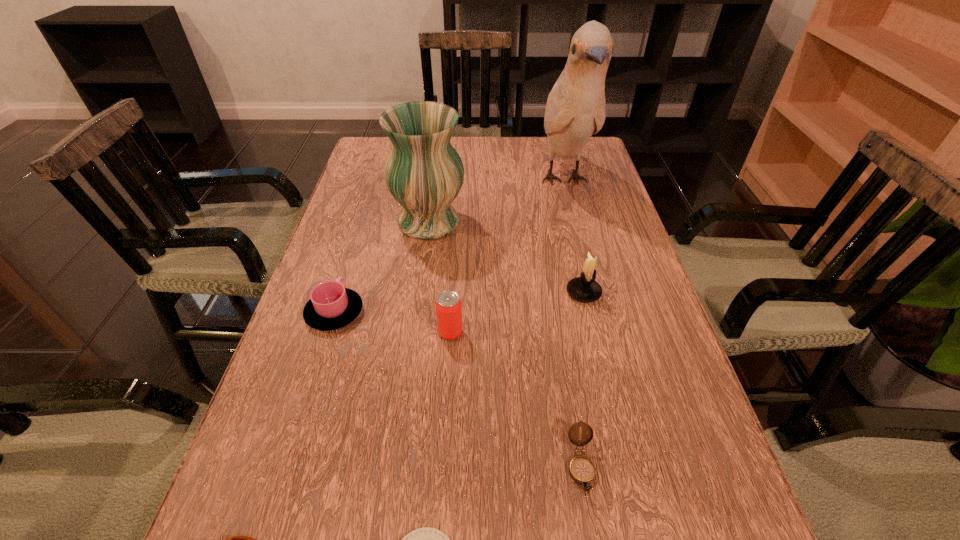
The image size is (960, 540). Identify the location of object that can be found as the third closest to the fourth tallest object. (424, 173).

Identify which compass is the closest to the cup. Please provide its 2D coordinates. Your answer should be formatted as a tuple, i.e. [(x, y)], where the tuple contains the x and y coordinates of a point satisfying the conditions above.

[(235, 539)]

This screenshot has height=540, width=960. What are the coordinates of `compass that stands as the closest to the cup` in the screenshot? It's located at (235, 539).

Locate an element on the screen. This screenshot has height=540, width=960. blank space that satisfies the following two spatial constraints: 1. on the side with the handle of the cup; 2. on the right side of the sixth shortest object is located at coordinates (341, 293).